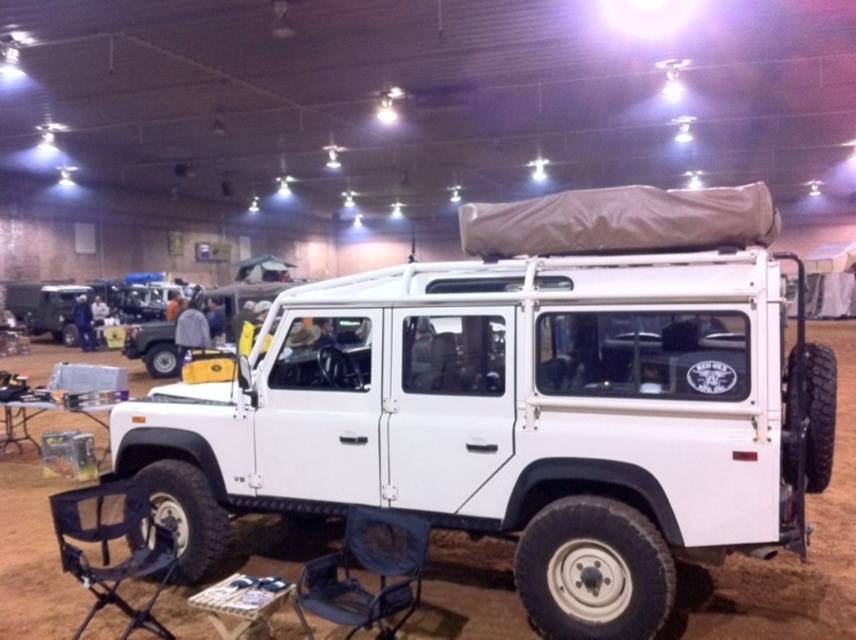
Question: Which object appears farthest from the camera in this image?

Choices:
 (A) white matte suv at center
 (B) gray fabric chair at lower center
 (C) black mesh folding chair at lower left

Answer: (C)

Question: Can you confirm if gray fabric chair at lower center is positioned to the left of black mesh folding chair at lower left?

Choices:
 (A) yes
 (B) no

Answer: (B)

Question: Which of the following is the farthest from the observer?

Choices:
 (A) (406, 616)
 (B) (81, 538)
 (C) (732, 320)

Answer: (B)

Question: Can you confirm if white matte suv at center is thinner than black mesh folding chair at lower left?

Choices:
 (A) yes
 (B) no

Answer: (B)

Question: Can you confirm if white matte suv at center is positioned above black mesh folding chair at lower left?

Choices:
 (A) no
 (B) yes

Answer: (B)

Question: Which object is closer to the camera taking this photo?

Choices:
 (A) black mesh folding chair at lower left
 (B) white matte suv at center
 (C) gray fabric chair at lower center

Answer: (C)